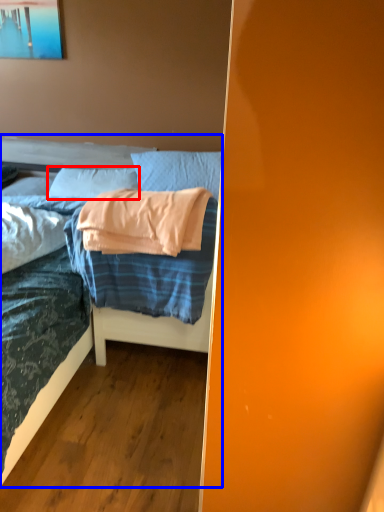
Question: Which object appears farthest to the camera in this image, pillow (highlighted by a red box) or bed (highlighted by a blue box)?

Choices:
 (A) pillow
 (B) bed

Answer: (A)